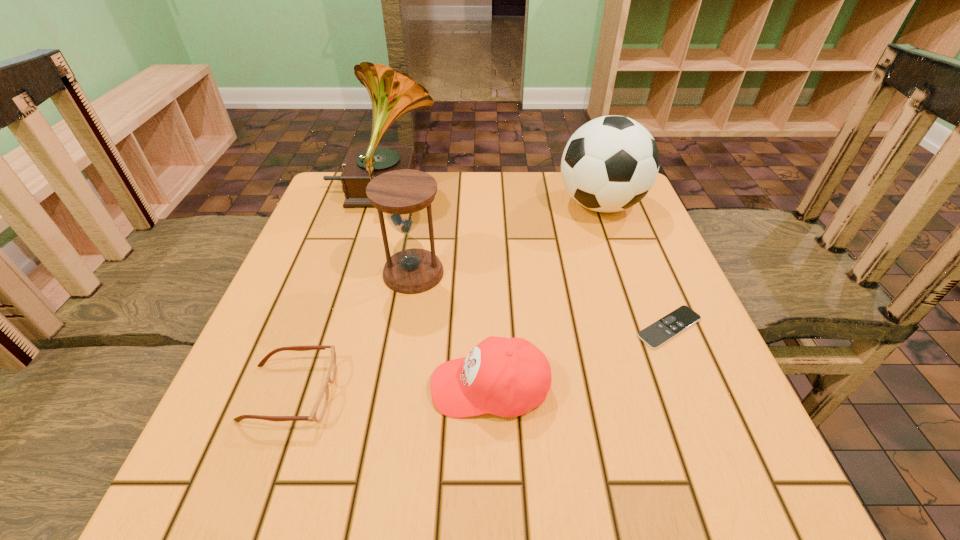
What are the coordinates of `remote control at the right edge` in the screenshot? It's located at (656, 334).

The height and width of the screenshot is (540, 960). Find the location of `object that is at the far left corner`. object that is at the far left corner is located at coordinates (392, 93).

This screenshot has height=540, width=960. In order to click on object located at the far right corner in this screenshot , I will do `click(609, 164)`.

The image size is (960, 540). In order to click on free space at the far edge in this screenshot , I will do `click(540, 203)`.

At what (x,y) coordinates should I click in order to perform the action: click on vacant space at the near edge of the desktop. Please return your answer as a coordinate pair (x, y). The height and width of the screenshot is (540, 960). Looking at the image, I should click on 619,443.

The image size is (960, 540). In order to click on vacant space at the left edge of the desktop in this screenshot , I will do `click(300, 240)`.

In the image, there is a desktop. At what (x,y) coordinates should I click in order to perform the action: click on free space at the right edge. Please return your answer as a coordinate pair (x, y). The image size is (960, 540). Looking at the image, I should click on (643, 257).

The height and width of the screenshot is (540, 960). In the image, there is a desktop. Find the location of `free space at the far left corner`. free space at the far left corner is located at coordinates (324, 215).

The width and height of the screenshot is (960, 540). Find the location of `vacant space at the near right corner of the desktop`. vacant space at the near right corner of the desktop is located at coordinates (727, 443).

Find the location of a particular element. The image size is (960, 540). free space between the baseball cap and the remote control is located at coordinates (579, 357).